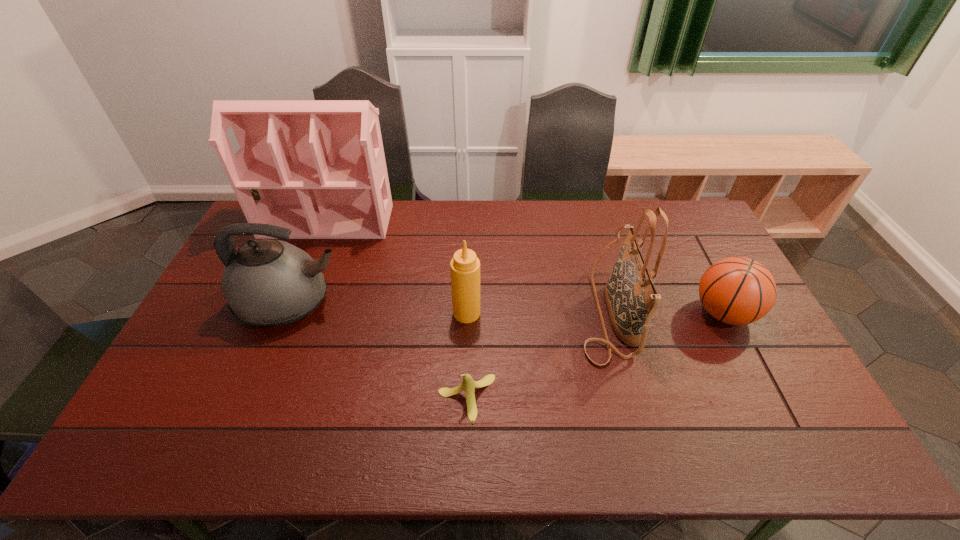
The height and width of the screenshot is (540, 960). In order to click on vacant area that satisfies the following two spatial constraints: 1. on the front side of the banana; 2. on the left side of the condiment in this screenshot , I will do `click(465, 398)`.

Find the location of `free space that satisfies the following two spatial constraints: 1. at the spout of the condiment; 2. on the left side of the kettle`. free space that satisfies the following two spatial constraints: 1. at the spout of the condiment; 2. on the left side of the kettle is located at coordinates (287, 313).

At what (x,y) coordinates should I click in order to perform the action: click on vacant space that satisfies the following two spatial constraints: 1. on the front-facing side of the handbag; 2. on the front side of the shortest object. Please return your answer as a coordinate pair (x, y). Looking at the image, I should click on (631, 398).

This screenshot has height=540, width=960. In order to click on vacant space that satisfies the following two spatial constraints: 1. at the spout of the kettle; 2. on the back side of the second shortest object in this screenshot , I will do `click(287, 313)`.

In order to click on free space that satisfies the following two spatial constraints: 1. on the front-facing side of the farthest object; 2. at the spout of the kettle in this screenshot , I will do `click(295, 302)`.

Identify the location of vacant area that satisfies the following two spatial constraints: 1. on the front-facing side of the rightmost object; 2. on the left side of the tallest object. This screenshot has width=960, height=540. (291, 313).

This screenshot has height=540, width=960. What are the coordinates of `vacant space that satisfies the following two spatial constraints: 1. on the back side of the banana; 2. on the right side of the basketball` in the screenshot? It's located at (468, 313).

Find the location of a particular element. The image size is (960, 540). vacant position in the image that satisfies the following two spatial constraints: 1. on the front-facing side of the handbag; 2. on the left side of the basketball is located at coordinates (609, 313).

The height and width of the screenshot is (540, 960). What are the coordinates of `free location that satisfies the following two spatial constraints: 1. on the front-facing side of the basketball; 2. on the left side of the dollhouse` in the screenshot? It's located at (291, 313).